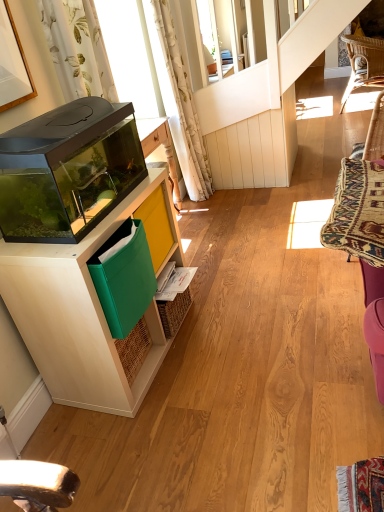
I want to click on vacant area that is in front of white wood cabinet at left, so click(157, 433).